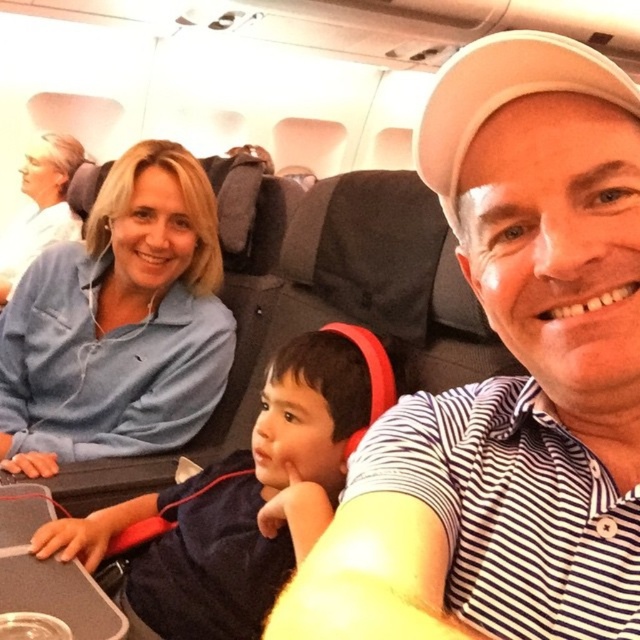
You are an airline employee checking seat assignments. You notice two passengers wearing the white striped polo shirt at center and the blue cotton shirt at upper left. Which passenger is wearing a narrower shirt?

The white striped polo shirt at center is narrower than the blue cotton shirt at upper left.

You are a flight attendant standing at the back of the airplane cabin. You need to locate the blue cotton shirt at upper left for an emergency medical kit. Based on the coordinates provided, where should you look relative to the main cabin door?

The blue cotton shirt at upper left is located at coordinates point (120, 323), which would be approximately halfway along the left side of the cabin near the front, relative to the main cabin door.

Based on the photo, you are sitting in the airplane cabin and want to know which object is positioned higher between the white striped polo shirt at center and the dark blue fabric at center. According to the scene, which one is higher?

The white striped polo shirt at center is located above the dark blue fabric at center, so the white striped polo shirt at center is higher.